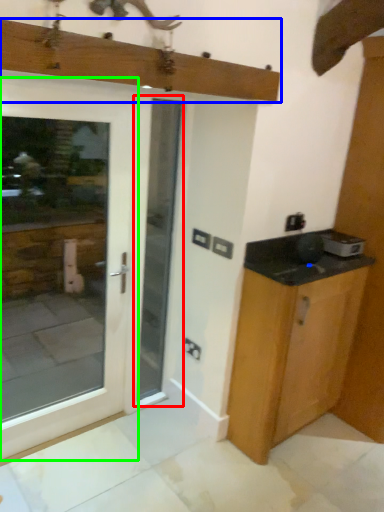
Question: Which object is positioned closest to screen door (highlighted by a red box)? Select from mantle (highlighted by a blue box) and door (highlighted by a green box).

Choices:
 (A) mantle
 (B) door

Answer: (A)